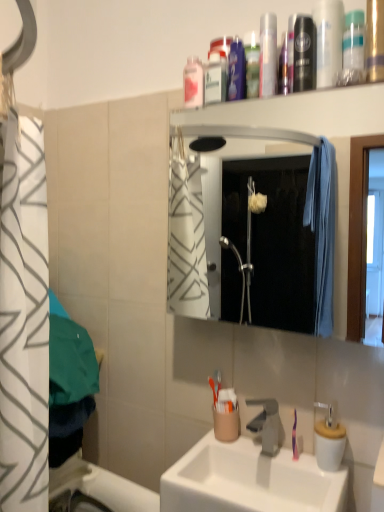
Where is `translucent plastic bottle at upper right, which appears as the third mouthwash when viewed from the back`? This screenshot has width=384, height=512. translucent plastic bottle at upper right, which appears as the third mouthwash when viewed from the back is located at coordinates (353, 49).

The width and height of the screenshot is (384, 512). Identify the location of metallic silver canister at upper right. (328, 41).

Find the location of `satin nickel faucet at sink center`. satin nickel faucet at sink center is located at coordinates (266, 424).

What is the approximate width of translucent plastic mouthwash at upper center, which ranks as the 3th mouthwash in right-to-left order?

The width of translucent plastic mouthwash at upper center, which ranks as the 3th mouthwash in right-to-left order, is 1.58 inches.

You are a GUI agent. You are given a task and a screenshot of the screen. Output one action in this format:
    pyautogui.click(x=<x>, y=<y>)
    Task: Click on the white ceramic sink at center
    
    Given the screenshot: What is the action you would take?
    pyautogui.click(x=249, y=479)

Consider the image. Between satin nickel faucet at sink center and pink plastic toothbrush at lower right, which one has smaller size?

pink plastic toothbrush at lower right is smaller.

Does satin nickel faucet at sink center have a lesser width compared to pink plastic toothbrush at lower right?

No, satin nickel faucet at sink center is not thinner than pink plastic toothbrush at lower right.

Would you say satin nickel faucet at sink center contains pink plastic toothbrush at lower right?

No, pink plastic toothbrush at lower right is not surrounded by satin nickel faucet at sink center.

In the scene shown: Does satin nickel faucet at sink center have a greater height compared to white ceramic sink at center?

In fact, satin nickel faucet at sink center may be shorter than white ceramic sink at center.

Considering the positions of objects satin nickel faucet at sink center and white ceramic sink at center in the image provided, who is more to the right, satin nickel faucet at sink center or white ceramic sink at center?

Positioned to the right is satin nickel faucet at sink center.

Is satin nickel faucet at sink center located outside white ceramic sink at center?

Indeed, satin nickel faucet at sink center is completely outside white ceramic sink at center.

Considering the sizes of satin nickel faucet at sink center and white ceramic sink at center in the image, is satin nickel faucet at sink center wider or thinner than white ceramic sink at center?

Clearly, satin nickel faucet at sink center has less width compared to white ceramic sink at center.

Does pink plastic toothbrush at lower right turn towards white glossy mirror at upper center?

No.

Considering the positions of point (293, 457) and point (311, 221), is point (293, 457) closer or farther from the camera than point (311, 221)?

Point (293, 457) is closer to the camera than point (311, 221).

Do you think pink plastic toothbrush at lower right is within white glossy mirror at upper center, or outside of it?

pink plastic toothbrush at lower right is not enclosed by white glossy mirror at upper center.

From the image's perspective, which one is positioned lower, pink plastic toothbrush at lower right or white glossy mirror at upper center?

pink plastic toothbrush at lower right appears lower in the image.

Between metallic silver canister at upper right and pink plastic mouthwash at upper center, marked as the 1th mouthwash in a back-to-front arrangement, which one is positioned in front?

metallic silver canister at upper right.

Which mouthwash is the 4th one when counting from the back of the metallic silver canister at upper right? Please provide its 2D coordinates.

[(193, 82)]

Which is behind, point (317, 83) or point (201, 78)?

Point (201, 78)

Can you tell me how much metallic silver canister at upper right and pink plastic mouthwash at upper center, arranged as the fourth mouthwash when viewed from the front, differ in facing direction?

metallic silver canister at upper right and pink plastic mouthwash at upper center, arranged as the fourth mouthwash when viewed from the front, are facing 0.000777 degrees away from each other.

Is the position of white ceramic sink at center more distant than that of pink plastic mouthwash at upper center, arranged as the fourth mouthwash when viewed from the front?

That is False.

Is white ceramic sink at center with pink plastic mouthwash at upper center, marked as the 1th mouthwash in a back-to-front arrangement?

No, white ceramic sink at center is not with pink plastic mouthwash at upper center, marked as the 1th mouthwash in a back-to-front arrangement.

Looking at this image, can you confirm if white ceramic sink at center is thinner than pink plastic mouthwash at upper center, which is counted as the fourth mouthwash, starting from the right?

In fact, white ceramic sink at center might be wider than pink plastic mouthwash at upper center, which is counted as the fourth mouthwash, starting from the right.

Looking at this image, is white ceramic sink at center smaller than translucent plastic mouthwash at upper center, which is the 2th mouthwash from left to right?

No, white ceramic sink at center is not smaller than translucent plastic mouthwash at upper center, which is the 2th mouthwash from left to right.

Which is less distant, (195, 446) or (266, 42)?

The point (266, 42) is more forward.

Which of these two, white ceramic sink at center or translucent plastic mouthwash at upper center, which is the 2th mouthwash from left to right, is wider?

white ceramic sink at center is wider.

Consider the image. Is white ceramic sink at center not near translucent plastic mouthwash at upper center, placed as the 3th mouthwash when sorted from front to back?

white ceramic sink at center is far away from translucent plastic mouthwash at upper center, placed as the 3th mouthwash when sorted from front to back.

From the image's perspective, is metallic silver canister at upper right over translucent plastic mouthwash at upper center, arranged as the second mouthwash when viewed from the back?

Yes, from the image's perspective, metallic silver canister at upper right is above translucent plastic mouthwash at upper center, arranged as the second mouthwash when viewed from the back.

Would you say metallic silver canister at upper right is to the left or to the right of translucent plastic mouthwash at upper center, arranged as the second mouthwash when viewed from the back, in the picture?

Clearly, metallic silver canister at upper right is on the right of translucent plastic mouthwash at upper center, arranged as the second mouthwash when viewed from the back, in the image.

Which object is further away from the camera taking this photo, metallic silver canister at upper right or translucent plastic mouthwash at upper center, arranged as the second mouthwash when viewed from the back?

translucent plastic mouthwash at upper center, arranged as the second mouthwash when viewed from the back, is further away from the camera.

Is point (320, 2) less distant than point (276, 67)?

Yes, point (320, 2) is in front of point (276, 67).

Where is `toothbrush on the right of satin nickel faucet at sink center`? Image resolution: width=384 pixels, height=512 pixels. toothbrush on the right of satin nickel faucet at sink center is located at coordinates (295, 438).

What are the coordinates of `tap located above the white ceramic sink at center (from the image's perspective)` in the screenshot? It's located at (266, 424).

Considering their positions, is metallic silver canister at upper right positioned further to translucent plastic bottle at upper right, positioned as the second mouthwash in front-to-back order, than pink plastic mouthwash at upper center, marked as the 1th mouthwash in a back-to-front arrangement?

pink plastic mouthwash at upper center, marked as the 1th mouthwash in a back-to-front arrangement.

Considering their positions, is translucent plastic bottle at upper right, positioned as the second mouthwash in front-to-back order, positioned further to satin nickel faucet at sink center than white ceramic sink at center?

translucent plastic bottle at upper right, positioned as the second mouthwash in front-to-back order, is positioned further to the anchor satin nickel faucet at sink center.

From the image, which object appears to be nearer to pink plastic mouthwash at upper center, marked as the 1th mouthwash in a back-to-front arrangement, metallic silver canister at upper right or pink plastic toothbrush at lower right?

The object closer to pink plastic mouthwash at upper center, marked as the 1th mouthwash in a back-to-front arrangement, is metallic silver canister at upper right.

Which object lies nearer to the anchor point translucent plastic bottle at upper right, which is the 1th mouthwash in right-to-left order, satin nickel faucet at sink center or pink plastic mouthwash at upper center, marked as the 1th mouthwash in a back-to-front arrangement?

pink plastic mouthwash at upper center, marked as the 1th mouthwash in a back-to-front arrangement, is positioned closer to the anchor translucent plastic bottle at upper right, which is the 1th mouthwash in right-to-left order.

Based on their spatial positions, is translucent plastic bottle at upper right, positioned as the second mouthwash in front-to-back order, or pink plastic mouthwash at upper center, arranged as the fourth mouthwash when viewed from the front, further from metallic silver canister at upper right?

pink plastic mouthwash at upper center, arranged as the fourth mouthwash when viewed from the front.

Based on their spatial positions, is pink plastic mouthwash at upper center, arranged as the fourth mouthwash when viewed from the front, or translucent plastic bottle at upper right, the 4th mouthwash positioned from the left, closer to satin nickel faucet at sink center?

pink plastic mouthwash at upper center, arranged as the fourth mouthwash when viewed from the front, lies closer to satin nickel faucet at sink center than the other object.

Which object lies further to the anchor point satin nickel faucet at sink center, pink plastic toothbrush at lower right or white glossy mirror at upper center?

Among the two, white glossy mirror at upper center is located further to satin nickel faucet at sink center.

Consider the image. When comparing their distances from metallic silver mouthwash at upper center, the 4th mouthwash viewed from the back, does translucent plastic bottle at upper right, positioned as the second mouthwash in front-to-back order, or satin nickel faucet at sink center seem closer?

translucent plastic bottle at upper right, positioned as the second mouthwash in front-to-back order, is closer to metallic silver mouthwash at upper center, the 4th mouthwash viewed from the back.

Find the location of `toothbrush between metallic silver canister at upper right and satin nickel faucet at sink center vertically`. toothbrush between metallic silver canister at upper right and satin nickel faucet at sink center vertically is located at coordinates (295, 438).

At what (x,y) coordinates should I click in order to perform the action: click on tap between white ceramic sink at center and pink plastic toothbrush at lower right in the front-back direction. Please return your answer as a coordinate pair (x, y). The width and height of the screenshot is (384, 512). Looking at the image, I should click on (266, 424).

This screenshot has height=512, width=384. In order to click on toiletry between pink plastic mouthwash at upper center, arranged as the 1th mouthwash when viewed from the left, and translucent plastic bottle at upper right, positioned as the second mouthwash in front-to-back order, from left to right in this screenshot , I will do tap(328, 41).

At what (x,y) coordinates should I click in order to perform the action: click on mirror between translucent plastic bottle at upper right, which is the 1th mouthwash in right-to-left order, and pink plastic toothbrush at lower right vertically. Please return your answer as a coordinate pair (x, y). The width and height of the screenshot is (384, 512). Looking at the image, I should click on (253, 238).